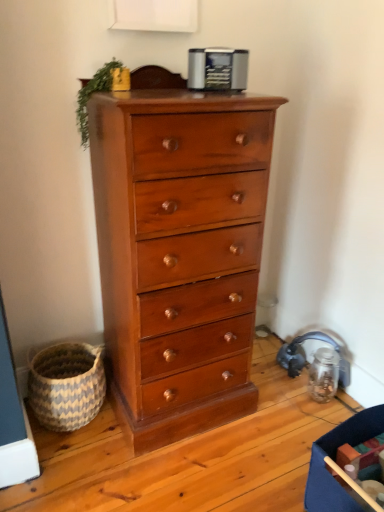
Question: Should I look upward or downward to see metallic silver toaster at upper center?

Choices:
 (A) up
 (B) down

Answer: (A)

Question: Considering the relative positions of shiny brown wood chest of drawers at center and green leafy plant at top left in the image provided, is shiny brown wood chest of drawers at center behind green leafy plant at top left?

Choices:
 (A) yes
 (B) no

Answer: (B)

Question: Is shiny brown wood chest of drawers at center next to green leafy plant at top left?

Choices:
 (A) yes
 (B) no

Answer: (B)

Question: Can you confirm if shiny brown wood chest of drawers at center is wider than green leafy plant at top left?

Choices:
 (A) yes
 (B) no

Answer: (A)

Question: Is shiny brown wood chest of drawers at center positioned far away from green leafy plant at top left?

Choices:
 (A) yes
 (B) no

Answer: (B)

Question: Is shiny brown wood chest of drawers at center positioned with its back to green leafy plant at top left?

Choices:
 (A) yes
 (B) no

Answer: (A)

Question: From the image's perspective, is shiny brown wood chest of drawers at center below green leafy plant at top left?

Choices:
 (A) no
 (B) yes

Answer: (B)

Question: Is blue and white woven basket at lower left not within green leafy plant at top left?

Choices:
 (A) no
 (B) yes

Answer: (B)

Question: Does blue and white woven basket at lower left have a smaller size compared to green leafy plant at top left?

Choices:
 (A) no
 (B) yes

Answer: (A)

Question: Is green leafy plant at top left at the back of blue and white woven basket at lower left?

Choices:
 (A) no
 (B) yes

Answer: (A)

Question: Is green leafy plant at top left located within blue and white woven basket at lower left?

Choices:
 (A) no
 (B) yes

Answer: (A)

Question: From a real-world perspective, is blue and white woven basket at lower left over green leafy plant at top left?

Choices:
 (A) no
 (B) yes

Answer: (A)

Question: From the image's perspective, is blue and white woven basket at lower left below green leafy plant at top left?

Choices:
 (A) yes
 (B) no

Answer: (A)

Question: Is there a large distance between blue and white woven basket at lower left and blue fabric storage box at lower right?

Choices:
 (A) no
 (B) yes

Answer: (A)